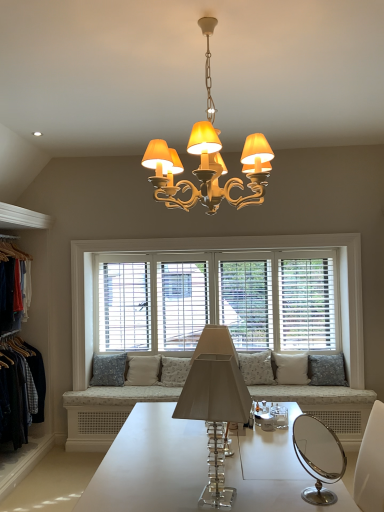
Question: Is denim jacket at left far away from white fabric pillow at right, the fifth pillow when ordered from left to right?

Choices:
 (A) yes
 (B) no

Answer: (A)

Question: Considering the relative sizes of denim jacket at left and white fabric pillow at right, the fifth pillow when ordered from left to right, in the image provided, is denim jacket at left smaller than white fabric pillow at right, the fifth pillow when ordered from left to right,?

Choices:
 (A) no
 (B) yes

Answer: (A)

Question: Could you tell me if denim jacket at left is facing white fabric pillow at right, arranged as the 2th pillow when viewed from the right?

Choices:
 (A) no
 (B) yes

Answer: (B)

Question: Does denim jacket at left have a lesser width compared to white fabric pillow at right, the fifth pillow when ordered from left to right?

Choices:
 (A) yes
 (B) no

Answer: (B)

Question: From the image's perspective, is denim jacket at left above white fabric pillow at right, the fifth pillow when ordered from left to right?

Choices:
 (A) no
 (B) yes

Answer: (B)

Question: From the image's perspective, is denim jacket at left located above or below floral fabric pillow at center, which is counted as the 4th pillow, starting from the left?

Choices:
 (A) below
 (B) above

Answer: (B)

Question: In terms of size, does denim jacket at left appear bigger or smaller than floral fabric pillow at center, which is counted as the 4th pillow, starting from the left?

Choices:
 (A) big
 (B) small

Answer: (A)

Question: From a real-world perspective, is denim jacket at left above or below floral fabric pillow at center, acting as the 3th pillow starting from the right?

Choices:
 (A) above
 (B) below

Answer: (A)

Question: Is point (8, 254) positioned closer to the camera than point (238, 362)?

Choices:
 (A) closer
 (B) farther

Answer: (A)

Question: Would you say floral fabric pillow at center, which is counted as the 4th pillow, starting from the left, is to the left or to the right of gray fabric pillow at right, which is counted as the 1th pillow, starting from the right, in the picture?

Choices:
 (A) right
 (B) left

Answer: (B)

Question: In terms of height, does floral fabric pillow at center, which is counted as the 4th pillow, starting from the left, look taller or shorter compared to gray fabric pillow at right, which is counted as the 1th pillow, starting from the right?

Choices:
 (A) short
 (B) tall

Answer: (A)

Question: Which is correct: floral fabric pillow at center, which is counted as the 4th pillow, starting from the left, is inside gray fabric pillow at right, which is counted as the 1th pillow, starting from the right, or outside of it?

Choices:
 (A) outside
 (B) inside

Answer: (A)

Question: Is floral fabric pillow at center, acting as the 3th pillow starting from the right, bigger or smaller than gray fabric pillow at right, which is counted as the 1th pillow, starting from the right?

Choices:
 (A) big
 (B) small

Answer: (B)

Question: Considering the positions of beige fabric pillow at center, which appears as the 5th pillow when viewed from the right, and white wood window at center in the image, is beige fabric pillow at center, which appears as the 5th pillow when viewed from the right, wider or thinner than white wood window at center?

Choices:
 (A) wide
 (B) thin

Answer: (A)

Question: From the image's perspective, is beige fabric pillow at center, which ranks as the second pillow in left-to-right order, located above or below white wood window at center?

Choices:
 (A) below
 (B) above

Answer: (A)